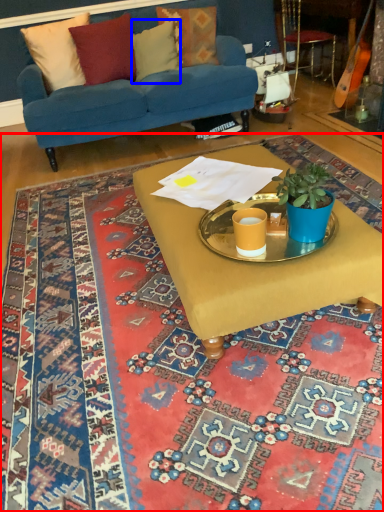
Question: Which object appears farthest to the camera in this image, mat (highlighted by a red box) or pillow (highlighted by a blue box)?

Choices:
 (A) mat
 (B) pillow

Answer: (B)